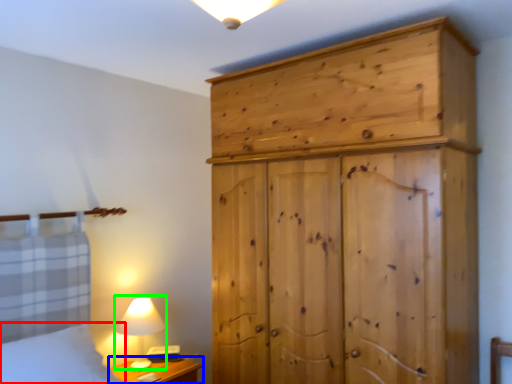
Question: Estimate the real-world distances between objects in this image. Which object is farther from bedding (highlighted by a red box), nightstand (highlighted by a blue box) or table lamp (highlighted by a green box)?

Choices:
 (A) nightstand
 (B) table lamp

Answer: (A)